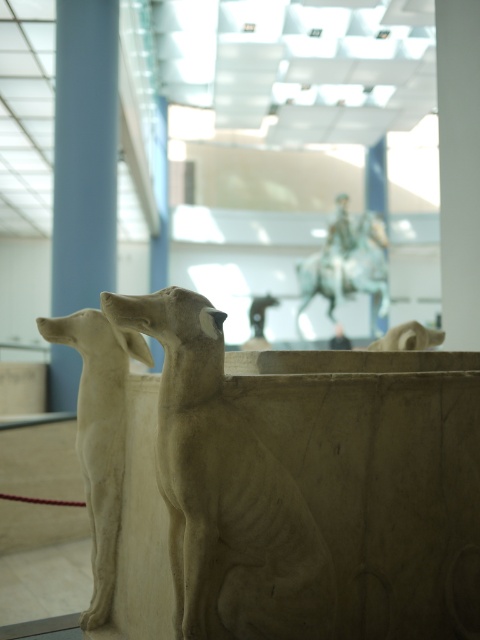
Question: Can you confirm if white stone dog at center is bigger than bronze statue at upper center?

Choices:
 (A) yes
 (B) no

Answer: (B)

Question: Based on their relative distances, which object is farther from the beige stone dog at center?

Choices:
 (A) white stone dog at center
 (B) bronze statue at upper center
 (C) blue stone pillar at left

Answer: (B)

Question: Can you confirm if beige stone dog at center is bigger than bronze statue at upper center?

Choices:
 (A) yes
 (B) no

Answer: (B)

Question: Estimate the real-world distances between objects in this image. Which object is farther from the blue stone pillar at left?

Choices:
 (A) white stone dog at center
 (B) bronze statue at upper center
 (C) beige stone dog at center

Answer: (C)

Question: Does beige stone dog at center appear on the right side of bronze statue at upper center?

Choices:
 (A) no
 (B) yes

Answer: (A)

Question: Which object appears closest to the camera in this image?

Choices:
 (A) bronze statue at upper center
 (B) blue stone pillar at left

Answer: (B)